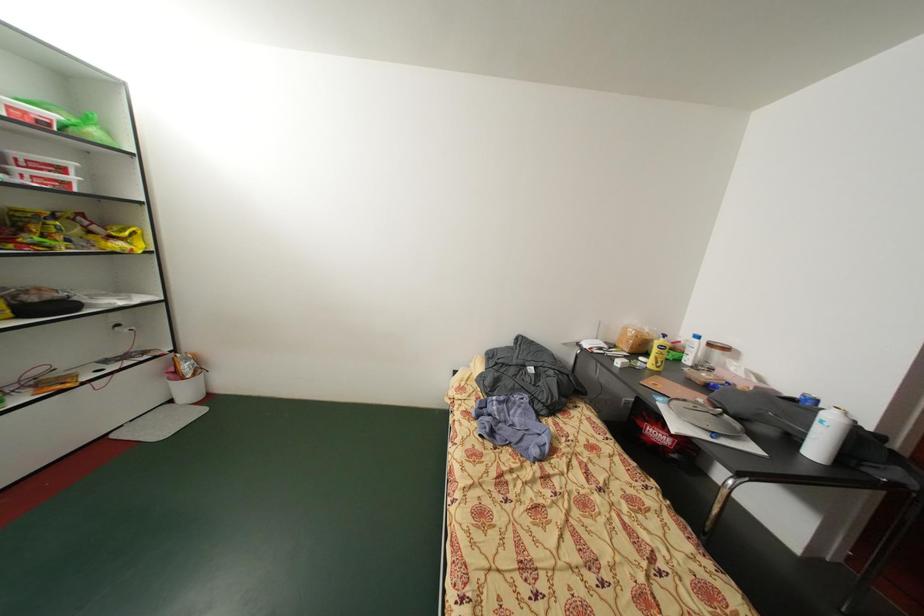
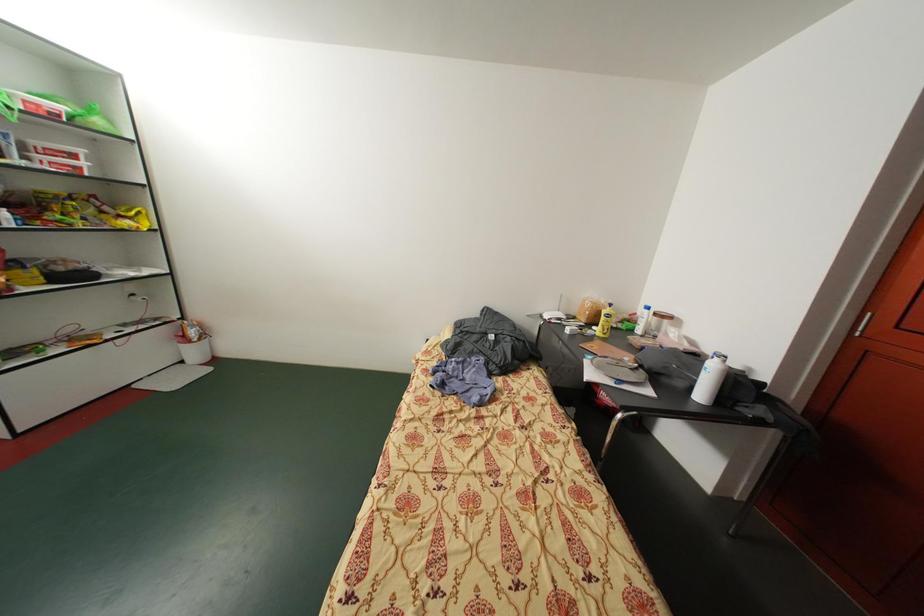
Question: The images are taken continuously from a first-person perspective. In which direction is your viewpoint rotating?

Choices:
 (A) Left
 (B) Right
 (C) Up
 (D) Down

Answer: (D)